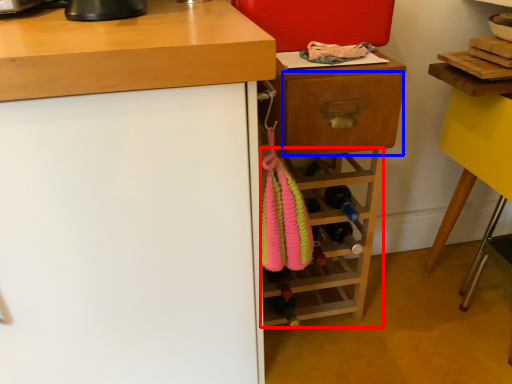
Question: Which point is closer to the camera, shelf (highlighted by a red box) or drawer (highlighted by a blue box)?

Choices:
 (A) shelf
 (B) drawer

Answer: (B)